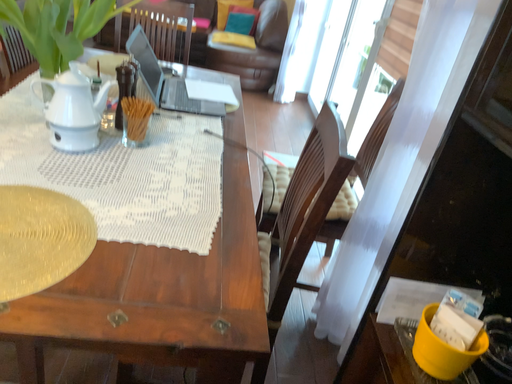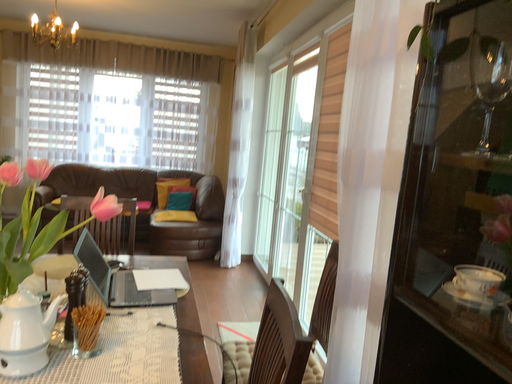
Question: How did the camera likely rotate when shooting the video?

Choices:
 (A) rotated upward
 (B) rotated downward

Answer: (A)